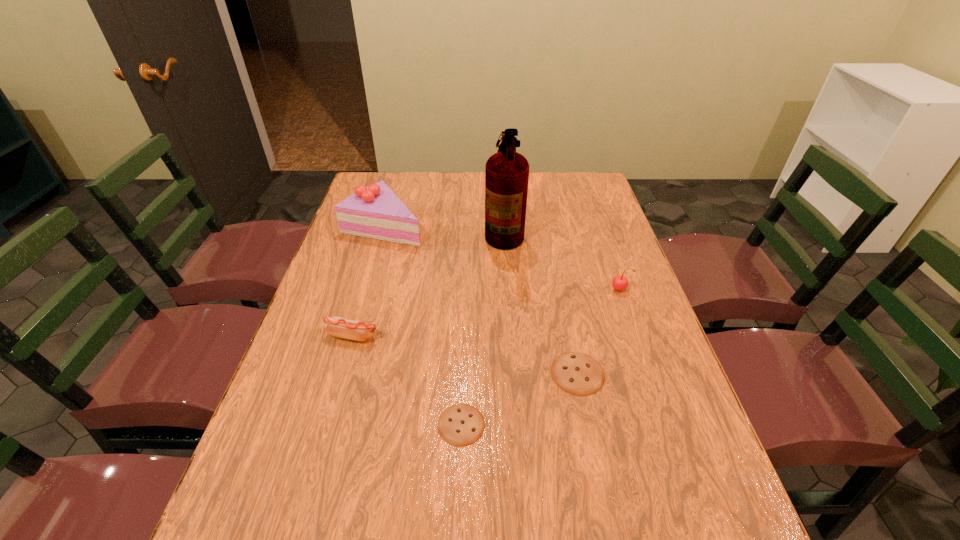
This screenshot has width=960, height=540. What are the coordinates of `cake at the left edge` in the screenshot? It's located at (376, 212).

The image size is (960, 540). In order to click on sausage that is at the left edge in this screenshot , I will do point(337,326).

Locate an element on the screen. The image size is (960, 540). object located in the right edge section of the desktop is located at coordinates (620, 282).

You are a GUI agent. You are given a task and a screenshot of the screen. Output one action in this format:
    pyautogui.click(x=<x>, y=<y>)
    Task: Click on the vacant space at the far edge of the desktop
    Image resolution: width=960 pixels, height=540 pixels.
    Given the screenshot: What is the action you would take?
    pyautogui.click(x=446, y=185)

In the image, there is a desktop. Find the location of `vacant space at the near edge`. vacant space at the near edge is located at coordinates (531, 503).

I want to click on blank space at the left edge of the desktop, so click(x=311, y=417).

The width and height of the screenshot is (960, 540). I want to click on vacant space at the right edge of the desktop, so click(585, 245).

The image size is (960, 540). I want to click on free space at the near left corner of the desktop, so click(x=284, y=466).

The width and height of the screenshot is (960, 540). In order to click on vacant space at the far right corner of the desktop in this screenshot , I will do 565,174.

In the image, there is a desktop. At what (x,y) coordinates should I click in order to perform the action: click on vacant space at the near right corner. Please return your answer as a coordinate pair (x, y). This screenshot has height=540, width=960. Looking at the image, I should click on pos(658,484).